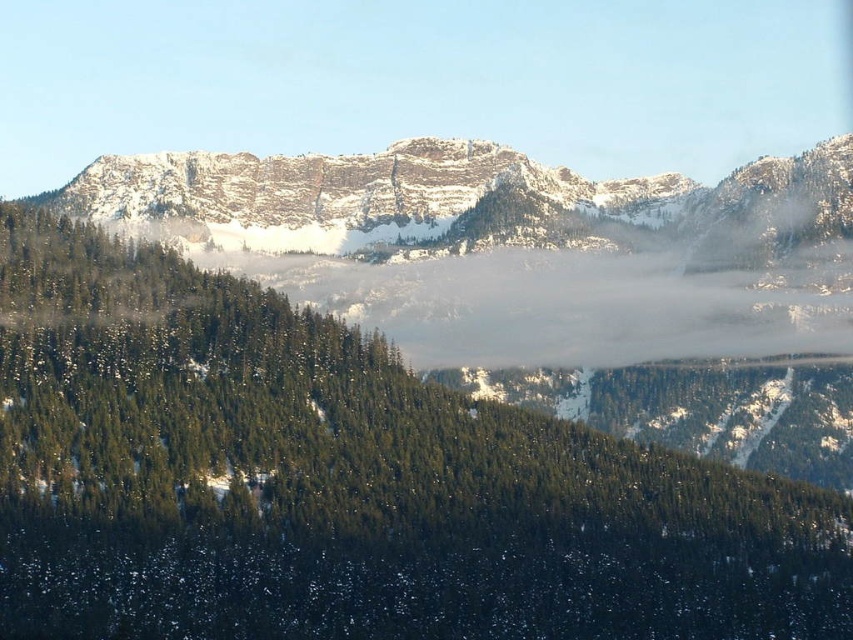
Question: Is green matte tree at center closer to camera compared to snowy rock formation at center?

Choices:
 (A) no
 (B) yes

Answer: (B)

Question: Observing the image, what is the correct spatial positioning of green matte tree at center in reference to snowy rock formation at center?

Choices:
 (A) above
 (B) below

Answer: (B)

Question: Does green matte tree at center appear on the right side of snowy rock formation at center?

Choices:
 (A) no
 (B) yes

Answer: (A)

Question: Which object appears farthest from the camera in this image?

Choices:
 (A) green matte tree at center
 (B) snowy rock formation at center

Answer: (B)

Question: Which object is closer to the camera taking this photo?

Choices:
 (A) green matte tree at center
 (B) snowy rock formation at center

Answer: (A)